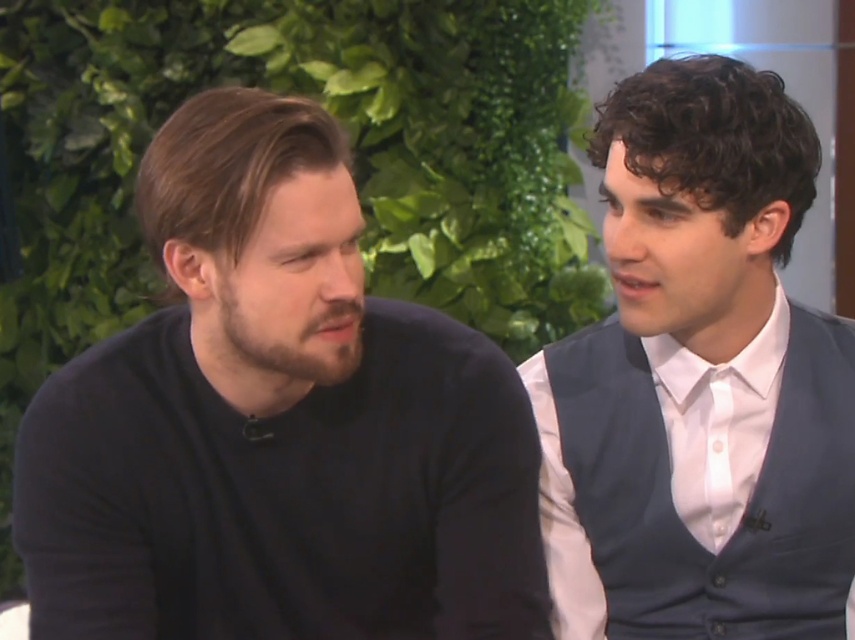
Can you confirm if black matte sweater at left is positioned to the right of white satin shirt at right?

No, black matte sweater at left is not to the right of white satin shirt at right.

Is point (217, 298) positioned after point (553, 458)?

No, it is not.

At what (x,y) coordinates should I click in order to perform the action: click on black matte sweater at left. Please return your answer as a coordinate pair (x, y). Looking at the image, I should click on (276, 422).